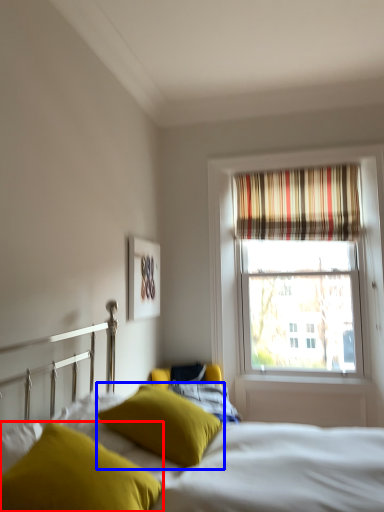
Question: Among these objects, which one is farthest to the camera, pillow (highlighted by a red box) or pillow (highlighted by a blue box)?

Choices:
 (A) pillow
 (B) pillow

Answer: (B)